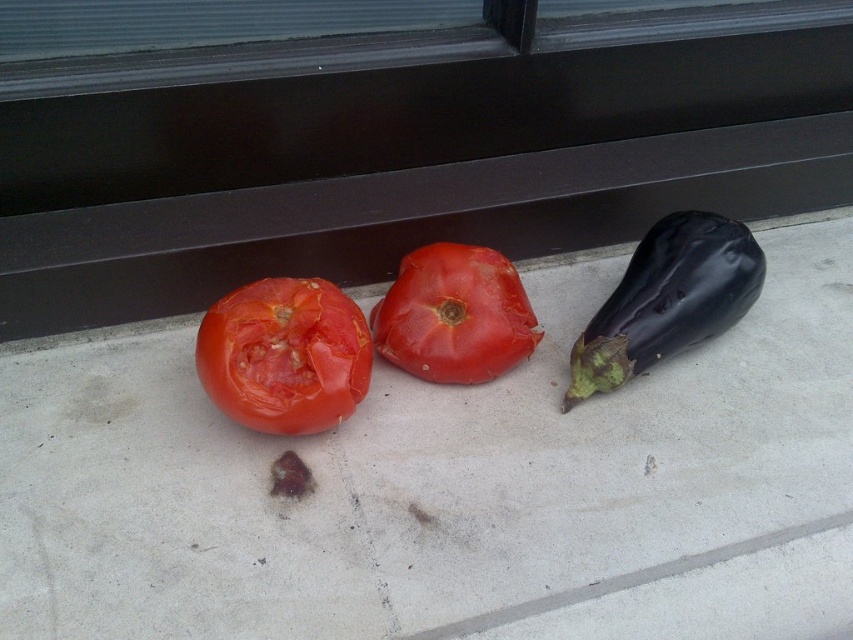
Question: Is concrete at center further to the viewer compared to shiny red tomato at center?

Choices:
 (A) no
 (B) yes

Answer: (B)

Question: Where is shiny red tomato at center located in relation to matte red tomato at center in the image?

Choices:
 (A) above
 (B) below

Answer: (B)

Question: Among these objects, which one is nearest to the camera?

Choices:
 (A) matte red tomato at center
 (B) shiny dark purple eggplant at right
 (C) concrete at center

Answer: (C)

Question: Does shiny red tomato at center appear over shiny dark purple eggplant at right?

Choices:
 (A) no
 (B) yes

Answer: (A)

Question: Which object is positioned farthest from the matte red tomato at center?

Choices:
 (A) shiny red tomato at center
 (B) shiny dark purple eggplant at right

Answer: (B)

Question: Among these objects, which one is nearest to the camera?

Choices:
 (A) shiny red tomato at center
 (B) concrete at center

Answer: (A)